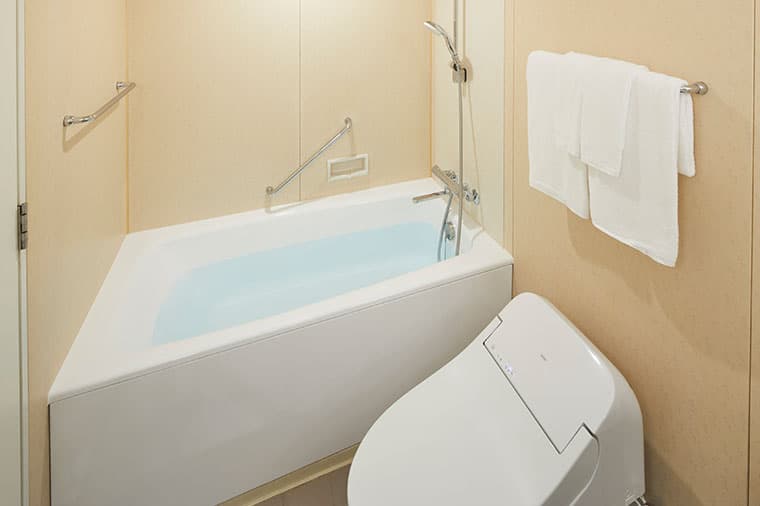
I want to click on towel, so click(x=665, y=193).